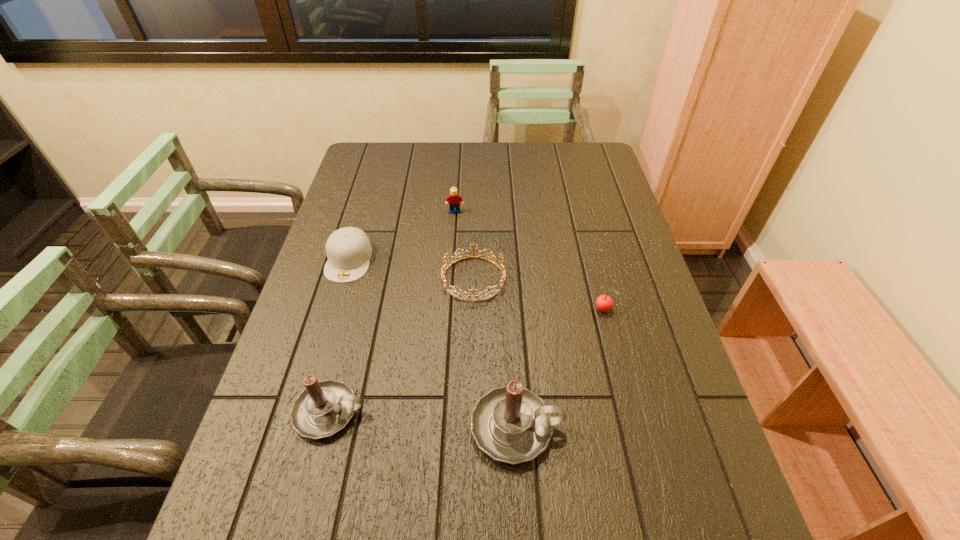
Please show where to add a candle on the right while keeping spacing even. Please provide its 2D coordinates. Your answer should be formatted as a tuple, i.e. [(x, y)], where the tuple contains the x and y coordinates of a point satisfying the conditions above.

[(712, 443)]